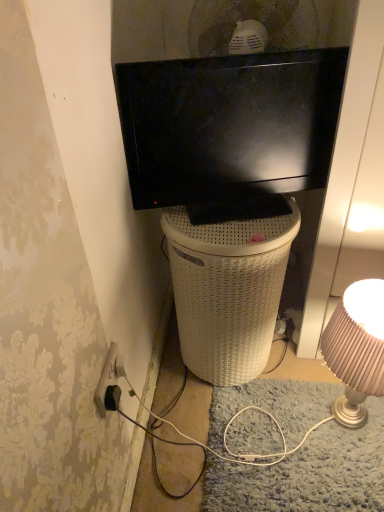
Question: Considering the relative positions of white wicker trash bin/can at center and black glossy tv at upper center in the image provided, is white wicker trash bin/can at center in front of black glossy tv at upper center?

Choices:
 (A) yes
 (B) no

Answer: (B)

Question: Can you confirm if white wicker trash bin/can at center is wider than black glossy tv at upper center?

Choices:
 (A) no
 (B) yes

Answer: (B)

Question: Considering the relative sizes of white wicker trash bin/can at center and black glossy tv at upper center in the image provided, is white wicker trash bin/can at center bigger than black glossy tv at upper center?

Choices:
 (A) yes
 (B) no

Answer: (A)

Question: From a real-world perspective, is white wicker trash bin/can at center located higher than black glossy tv at upper center?

Choices:
 (A) yes
 (B) no

Answer: (B)

Question: Is white wicker trash bin/can at center turned away from black glossy tv at upper center?

Choices:
 (A) yes
 (B) no

Answer: (B)

Question: Can black glossy tv at upper center be found inside white wicker trash bin/can at center?

Choices:
 (A) yes
 (B) no

Answer: (B)

Question: Can you confirm if black glossy tv at upper center is shorter than black plastic power outlet at lower left?

Choices:
 (A) no
 (B) yes

Answer: (A)

Question: Considering the relative sizes of black glossy tv at upper center and black plastic power outlet at lower left in the image provided, is black glossy tv at upper center wider than black plastic power outlet at lower left?

Choices:
 (A) yes
 (B) no

Answer: (A)

Question: Is black glossy tv at upper center in contact with black plastic power outlet at lower left?

Choices:
 (A) yes
 (B) no

Answer: (B)

Question: Is black glossy tv at upper center to the left of black plastic power outlet at lower left from the viewer's perspective?

Choices:
 (A) yes
 (B) no

Answer: (B)

Question: Could you tell me if black glossy tv at upper center is facing black plastic power outlet at lower left?

Choices:
 (A) no
 (B) yes

Answer: (A)

Question: Is black glossy tv at upper center surrounding black plastic power outlet at lower left?

Choices:
 (A) yes
 (B) no

Answer: (B)

Question: Can you confirm if black glossy tv at upper center is taller than matte gold lampshade at right?

Choices:
 (A) no
 (B) yes

Answer: (A)